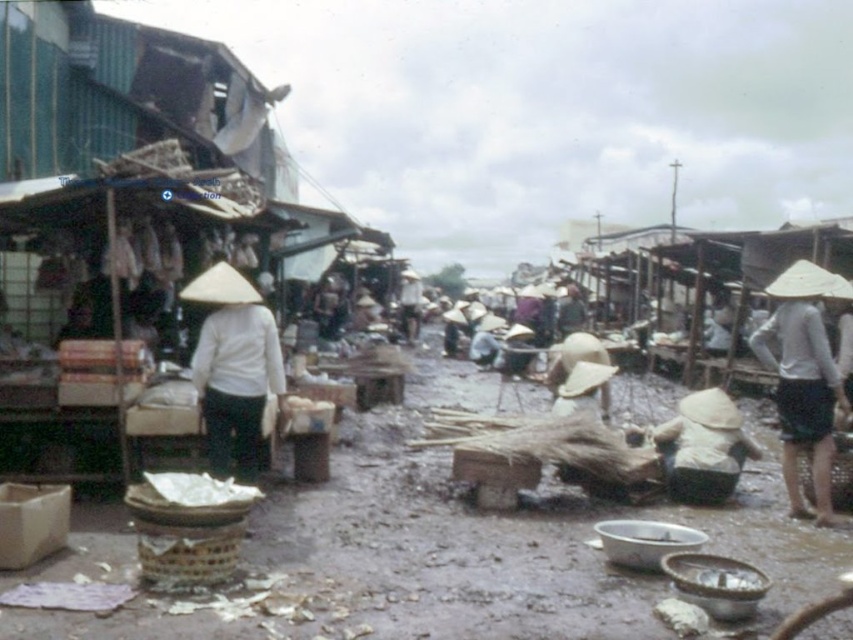
Can you confirm if white matte conical hat at center is taller than white straw hat at lower center?

Yes, white matte conical hat at center is taller than white straw hat at lower center.

Between point (259, 317) and point (706, 410), which one is positioned in front?

Point (259, 317) is more forward.

Locate an element on the screen. white matte conical hat at center is located at coordinates (233, 369).

Who is lower down, white woven hat at right or white straw hat at lower center?

Positioned lower is white straw hat at lower center.

Who is more forward, (820,337) or (741,449)?

Positioned in front is point (820,337).

At what (x,y) coordinates should I click in order to perform the action: click on white woven hat at right. Please return your answer as a coordinate pair (x, y). The height and width of the screenshot is (640, 853). Looking at the image, I should click on (804, 378).

Does white matte conical hat at center come behind white woven hat at right?

No, it is not.

Locate an element on the screen. This screenshot has width=853, height=640. white matte conical hat at center is located at coordinates (233, 369).

Locate an element on the screen. The height and width of the screenshot is (640, 853). white matte conical hat at center is located at coordinates (233, 369).